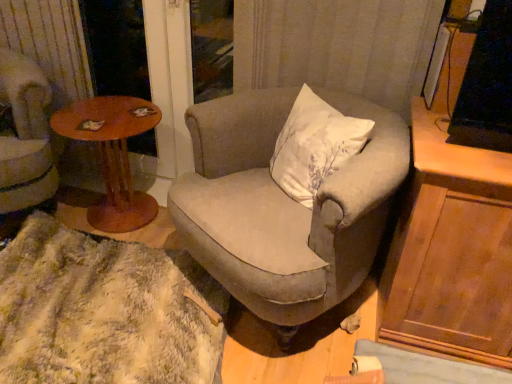
Question: Are wooden round table at left and textured beige armchair at center, which is the 2th chair in left-to-right order, beside each other?

Choices:
 (A) yes
 (B) no

Answer: (B)

Question: From a real-world perspective, is wooden round table at left on top of textured beige armchair at center, which ranks as the 1th chair in right-to-left order?

Choices:
 (A) no
 (B) yes

Answer: (A)

Question: From the image's perspective, is wooden round table at left over textured beige armchair at center, which is the 2th chair in left-to-right order?

Choices:
 (A) no
 (B) yes

Answer: (B)

Question: Is wooden round table at left outside textured beige armchair at center, which ranks as the 1th chair in right-to-left order?

Choices:
 (A) no
 (B) yes

Answer: (B)

Question: Is wooden round table at left positioned before textured beige armchair at center, which is the 2th chair in left-to-right order?

Choices:
 (A) no
 (B) yes

Answer: (A)

Question: Do you think wooden cabinet at right is within velvet beige armchair at left, acting as the second chair starting from the right, or outside of it?

Choices:
 (A) outside
 (B) inside

Answer: (A)

Question: Would you say wooden cabinet at right is to the left or to the right of velvet beige armchair at left, acting as the second chair starting from the right, in the picture?

Choices:
 (A) right
 (B) left

Answer: (A)

Question: In terms of width, does wooden cabinet at right look wider or thinner when compared to velvet beige armchair at left, acting as the second chair starting from the right?

Choices:
 (A) wide
 (B) thin

Answer: (B)

Question: Relative to velvet beige armchair at left, acting as the second chair starting from the right, is wooden cabinet at right in front or behind?

Choices:
 (A) behind
 (B) front

Answer: (B)

Question: From a real-world perspective, is wooden round table at left positioned above or below fuzzy white rug at lower left?

Choices:
 (A) above
 (B) below

Answer: (A)

Question: From the image's perspective, is wooden round table at left above or below fuzzy white rug at lower left?

Choices:
 (A) above
 (B) below

Answer: (A)

Question: Considering the positions of wooden round table at left and fuzzy white rug at lower left in the image, is wooden round table at left taller or shorter than fuzzy white rug at lower left?

Choices:
 (A) short
 (B) tall

Answer: (B)

Question: In the image, is wooden round table at left positioned in front of or behind fuzzy white rug at lower left?

Choices:
 (A) behind
 (B) front

Answer: (A)

Question: From the image's perspective, relative to velvet beige armchair at left, the first chair in the left-to-right sequence, is textured beige armchair at center, which is the 2th chair in left-to-right order, above or below?

Choices:
 (A) below
 (B) above

Answer: (A)

Question: From a real-world perspective, is textured beige armchair at center, which ranks as the 1th chair in right-to-left order, physically located above or below velvet beige armchair at left, the first chair in the left-to-right sequence?

Choices:
 (A) below
 (B) above

Answer: (A)